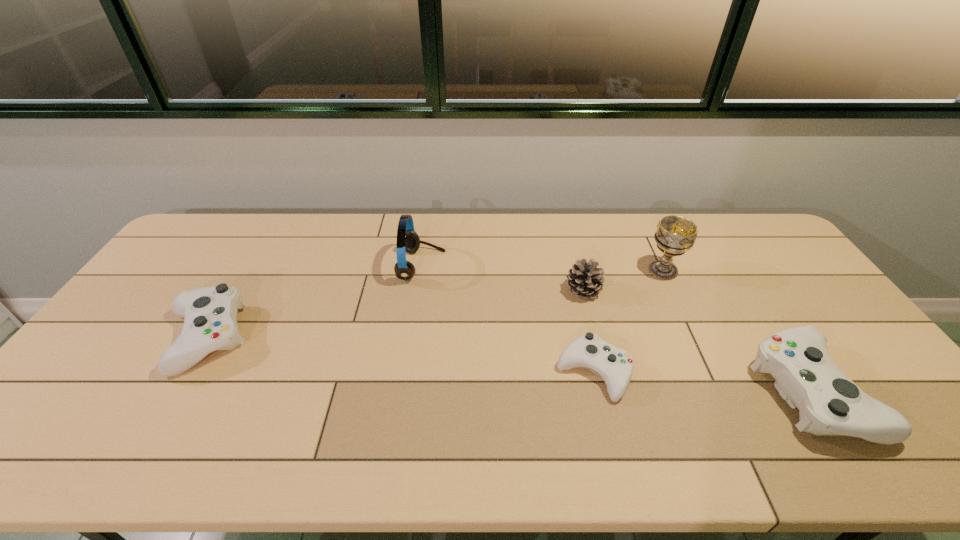
Find the location of `empty location between the shortest control and the leftmost control`. empty location between the shortest control and the leftmost control is located at coordinates (399, 356).

Locate an element on the screen. This screenshot has width=960, height=540. vacant area that lies between the second object from left to right and the shortest control is located at coordinates (508, 319).

Find the location of a particular element. This screenshot has width=960, height=540. unoccupied area between the rightmost object and the chalice is located at coordinates (736, 331).

What are the coordinates of `object that is the second closest to the second object from right to left` in the screenshot? It's located at (830, 404).

The image size is (960, 540). Find the location of `object that is the closest to the second object from right to left`. object that is the closest to the second object from right to left is located at coordinates (585, 279).

Identify which control is the nearest to the leftmost control. Please provide its 2D coordinates. Your answer should be formatted as a tuple, i.e. [(x, y)], where the tuple contains the x and y coordinates of a point satisfying the conditions above.

[(615, 365)]

Locate an element on the screen. the third closest control to the chalice is located at coordinates (210, 323).

Find the location of a particular element. vacant space that satisfies the following two spatial constraints: 1. with the microphone attached to the side of the shortest control; 2. on the left side of the headset is located at coordinates (406, 373).

In order to click on vacant region that satisfies the following two spatial constraints: 1. with the microphone attached to the side of the second object from right to left; 2. on the left side of the second object from left to right in this screenshot , I will do `click(421, 271)`.

Identify the location of free space that satisfies the following two spatial constraints: 1. with the microphone attached to the side of the second control from left to right; 2. on the right side of the fifth object from right to left. tap(406, 373).